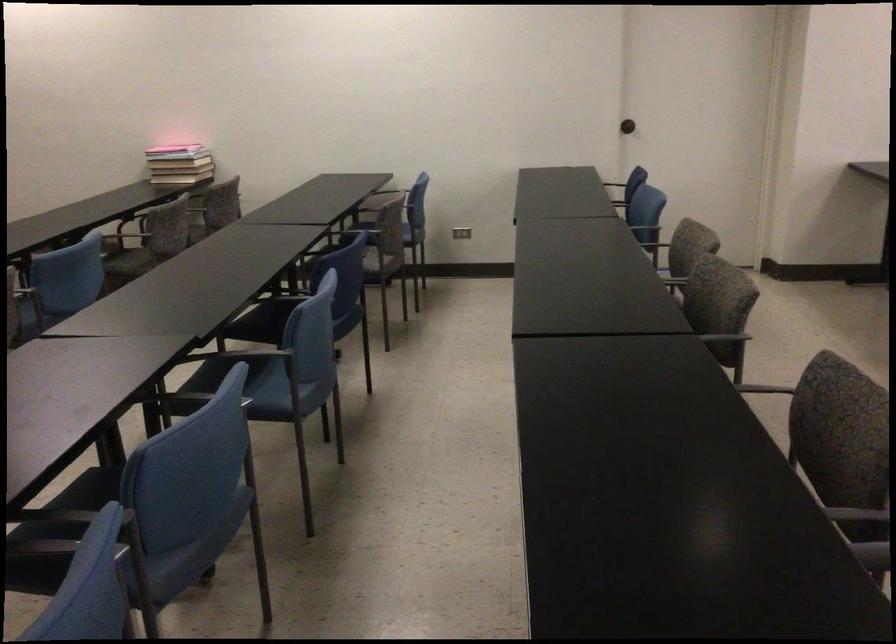
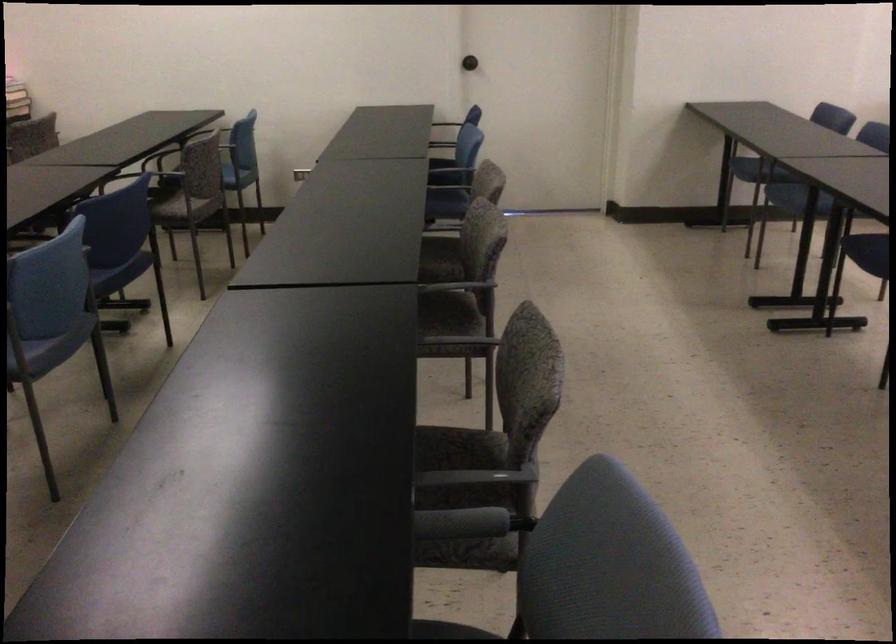
Question: The camera is either moving clockwise (left) or counter-clockwise (right) around the object. The first image is from the beginning of the video and the second image is from the end. Is the camera moving left or right when shooting the video?

Choices:
 (A) Left
 (B) Right

Answer: (A)